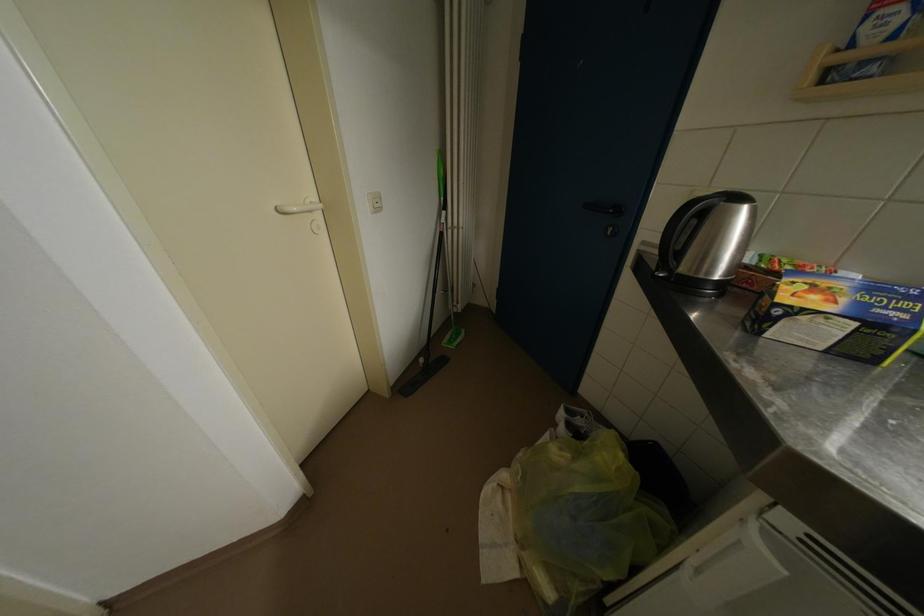
Describe the element at coordinates (707, 241) in the screenshot. I see `the kettle handle` at that location.